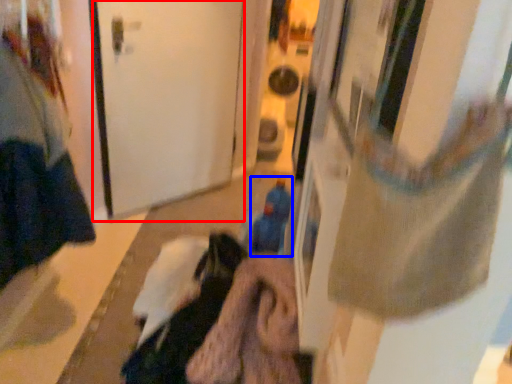
Question: Which object appears closest to the camera in this image, door (highlighted by a red box) or toy (highlighted by a blue box)?

Choices:
 (A) door
 (B) toy

Answer: (B)